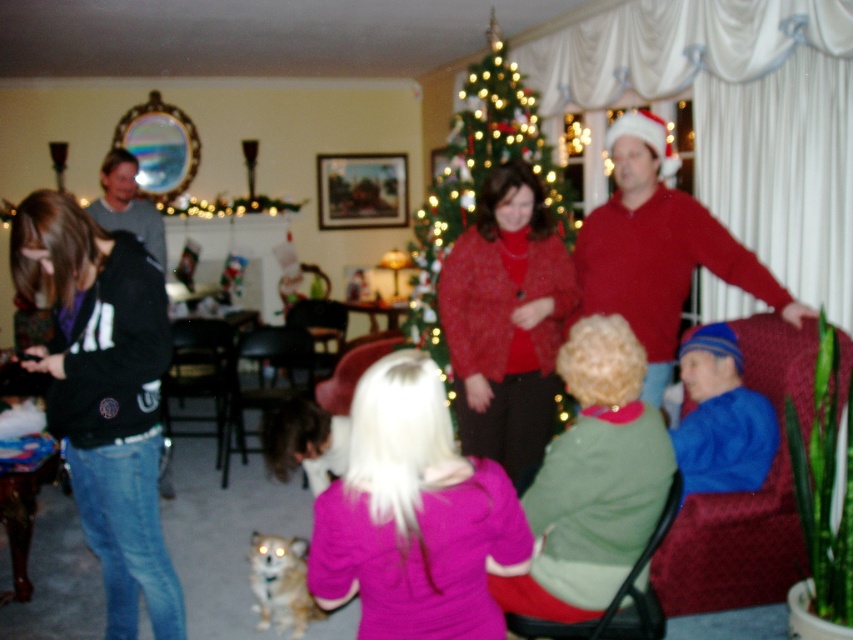
Consider the image. Does sparkly red sweater at center have a lesser width compared to velvet burgundy armchair at center?

Incorrect, sparkly red sweater at center's width is not less than velvet burgundy armchair at center's.

Does sparkly red sweater at center have a lesser height compared to velvet burgundy armchair at center?

In fact, sparkly red sweater at center may be taller than velvet burgundy armchair at center.

This screenshot has height=640, width=853. What do you see at coordinates (506, 320) in the screenshot?
I see `sparkly red sweater at center` at bounding box center [506, 320].

The image size is (853, 640). I want to click on sparkly red sweater at center, so click(506, 320).

Between pink fleece jacket at center and maroon fabric armchair at lower right, which one is positioned lower?

maroon fabric armchair at lower right

Where is `pink fleece jacket at center`? Image resolution: width=853 pixels, height=640 pixels. pink fleece jacket at center is located at coordinates (415, 515).

Which is behind, point (434, 616) or point (722, 586)?

Positioned behind is point (722, 586).

The height and width of the screenshot is (640, 853). Find the location of `pink fleece jacket at center`. pink fleece jacket at center is located at coordinates (415, 515).

Consider the image. Does red sweater at upper right have a lesser width compared to velvet burgundy armchair at center?

No, red sweater at upper right is not thinner than velvet burgundy armchair at center.

Is red sweater at upper right smaller than velvet burgundy armchair at center?

No, red sweater at upper right is not smaller than velvet burgundy armchair at center.

What do you see at coordinates (659, 250) in the screenshot?
I see `red sweater at upper right` at bounding box center [659, 250].

Locate an element on the screen. This screenshot has height=640, width=853. red sweater at upper right is located at coordinates (659, 250).